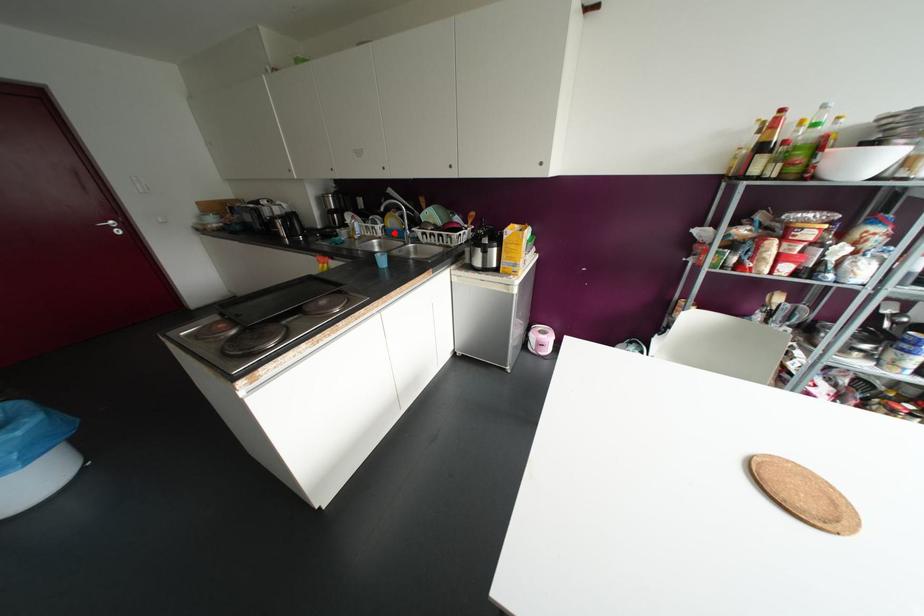
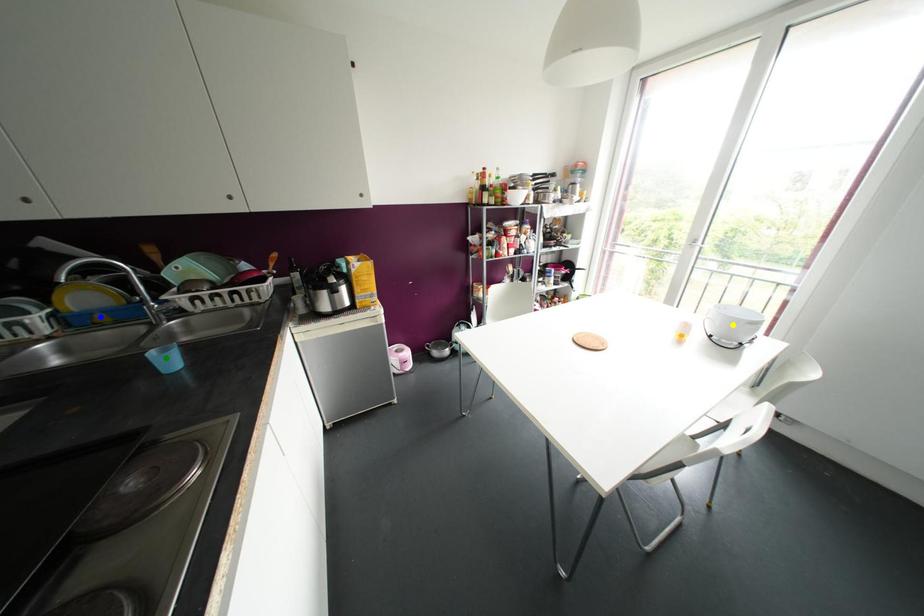
Question: I am providing you with two images of the same scene from different viewpoints. A red point is marked on the first image. You are given multiple points on the second image. Which point in image 2 represents the same 3d spot as the red point in image 1?

Choices:
 (A) yellow point
 (B) green point
 (C) blue point

Answer: (C)